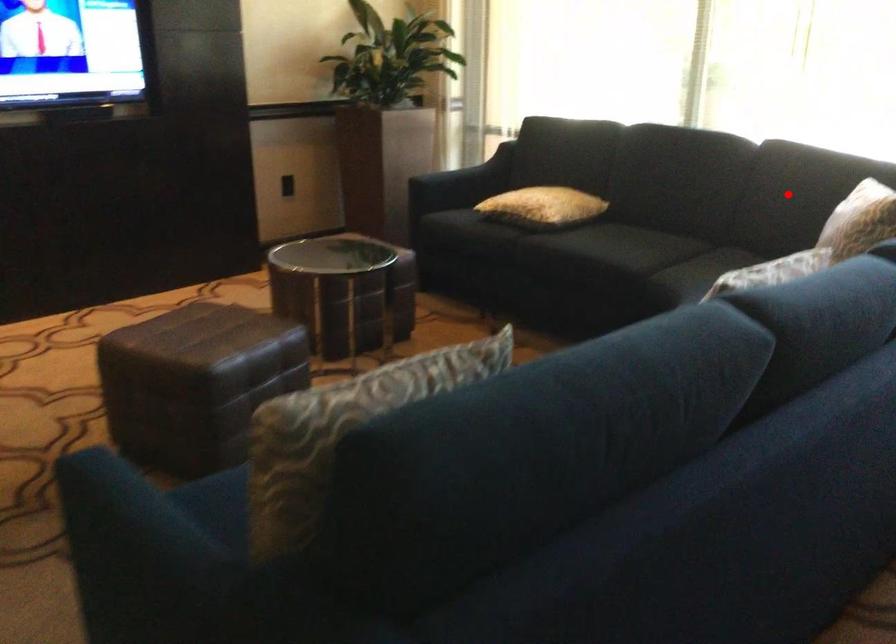
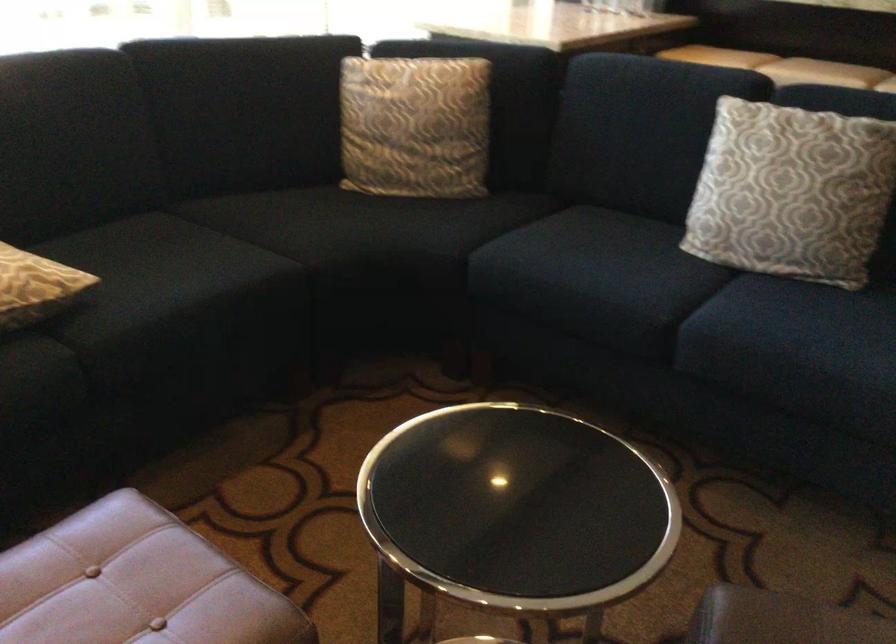
The point at the highlighted location is marked in the first image. Where is the corresponding point in the second image?

(238, 111)